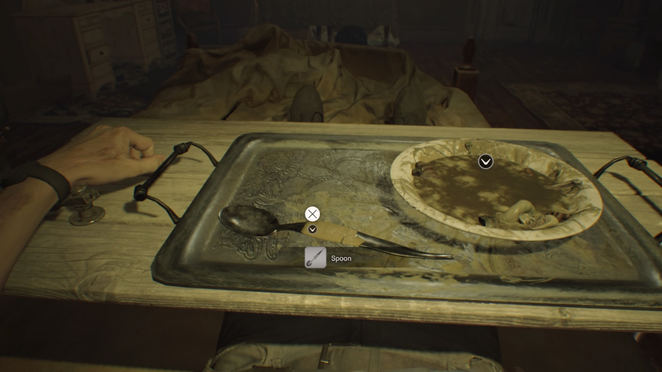
Where is `tray handle`? The width and height of the screenshot is (662, 372). tray handle is located at coordinates (140, 195), (649, 171).